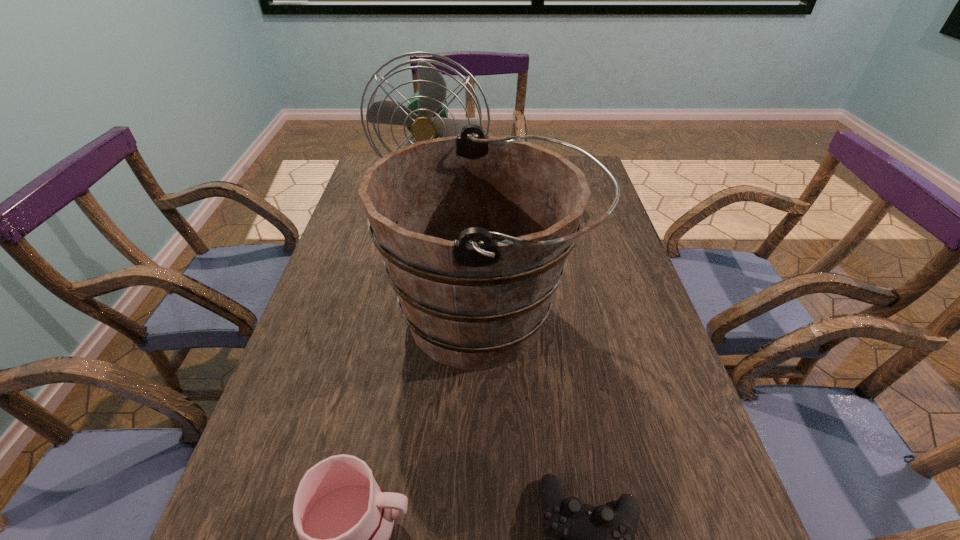
Locate an element on the screen. the farthest object is located at coordinates (426, 117).

What are the coordinates of `the second farthest object` in the screenshot? It's located at (474, 230).

Where is `the second tallest object`? This screenshot has width=960, height=540. the second tallest object is located at coordinates (474, 230).

Locate an element on the screen. vacant region located 0.130m in front of the farthest object, directing airflow is located at coordinates (424, 252).

What are the coordinates of `vacant space located 0.060m on the handle side of the third shortest object` in the screenshot? It's located at click(612, 318).

Identify the location of object present at the far edge. Image resolution: width=960 pixels, height=540 pixels. (426, 117).

Image resolution: width=960 pixels, height=540 pixels. Find the location of `object situated at the left edge`. object situated at the left edge is located at coordinates click(426, 117).

At what (x,y) coordinates should I click in order to perform the action: click on object that is at the right edge. Please return your answer as a coordinate pair (x, y). This screenshot has height=540, width=960. Looking at the image, I should click on (474, 230).

Where is `object that is at the far left corner`? The height and width of the screenshot is (540, 960). object that is at the far left corner is located at coordinates (426, 117).

In the image, there is a desktop. Where is `vacant space at the left edge`? The height and width of the screenshot is (540, 960). vacant space at the left edge is located at coordinates (357, 204).